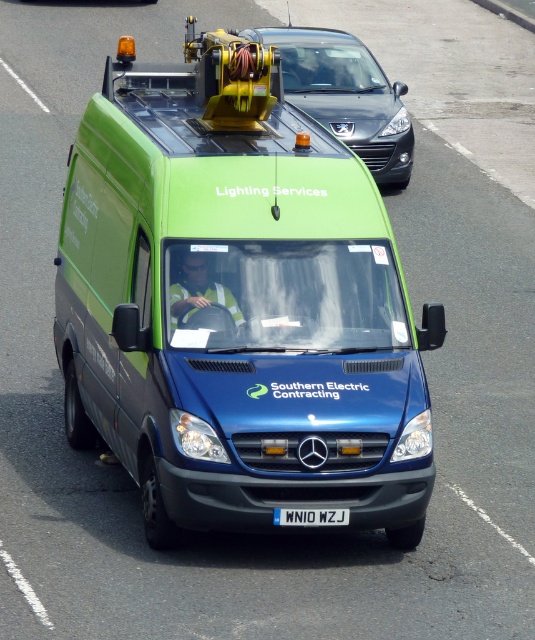
Question: Considering the real-world distances, which object is farthest from the white plastic license plate at center?

Choices:
 (A) matte black car at upper center
 (B) green matte van at center

Answer: (A)

Question: Does green matte van at center have a greater width compared to white plastic license plate at center?

Choices:
 (A) yes
 (B) no

Answer: (A)

Question: Observing the image, what is the correct spatial positioning of green matte van at center in reference to white plastic license plate at center?

Choices:
 (A) above
 (B) below

Answer: (A)

Question: Which object is closer to the camera taking this photo?

Choices:
 (A) matte black car at upper center
 (B) white plastic license plate at center
 (C) green matte van at center

Answer: (C)

Question: Which point is closer to the camera?

Choices:
 (A) white plastic license plate at center
 (B) matte black car at upper center

Answer: (A)

Question: Does matte black car at upper center appear over white plastic license plate at center?

Choices:
 (A) no
 (B) yes

Answer: (B)